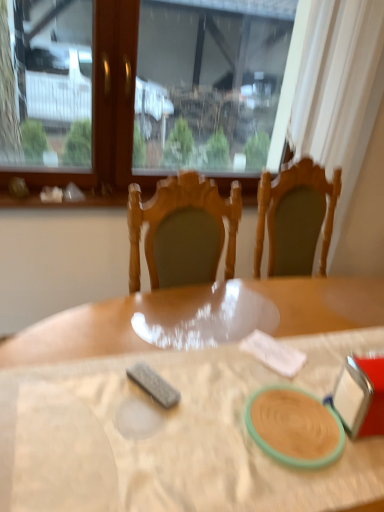
Question: Can you confirm if matte green plate at center is thinner than transparent glass window at upper center?

Choices:
 (A) yes
 (B) no

Answer: (B)

Question: Is matte green plate at center smaller than transparent glass window at upper center?

Choices:
 (A) yes
 (B) no

Answer: (A)

Question: Is matte green plate at center facing away from transparent glass window at upper center?

Choices:
 (A) no
 (B) yes

Answer: (A)

Question: From the image's perspective, is matte green plate at center below transparent glass window at upper center?

Choices:
 (A) no
 (B) yes

Answer: (B)

Question: From a real-world perspective, is matte green plate at center located higher than transparent glass window at upper center?

Choices:
 (A) yes
 (B) no

Answer: (B)

Question: From the image's perspective, is matte green plate at center located above or below transparent glass window at upper center?

Choices:
 (A) above
 (B) below

Answer: (B)

Question: Would you say matte green plate at center is inside or outside transparent glass window at upper center?

Choices:
 (A) outside
 (B) inside

Answer: (A)

Question: Considering the positions of matte green plate at center and transparent glass window at upper center in the image, is matte green plate at center wider or thinner than transparent glass window at upper center?

Choices:
 (A) thin
 (B) wide

Answer: (B)

Question: In the image, is matte green plate at center on the left side or the right side of transparent glass window at upper center?

Choices:
 (A) right
 (B) left

Answer: (A)

Question: Relative to matte green plate at center, is transparent glass window at upper center in front or behind?

Choices:
 (A) behind
 (B) front

Answer: (A)

Question: Do you think transparent glass window at upper center is within matte green plate at center, or outside of it?

Choices:
 (A) inside
 (B) outside

Answer: (B)

Question: Based on their sizes in the image, would you say transparent glass window at upper center is bigger or smaller than matte green plate at center?

Choices:
 (A) big
 (B) small

Answer: (A)

Question: From a real-world perspective, is transparent glass window at upper center above or below matte green plate at center?

Choices:
 (A) below
 (B) above

Answer: (B)

Question: From a real-world perspective, relative to transparent glass window at upper center, is wooden table at center vertically above or below?

Choices:
 (A) above
 (B) below

Answer: (B)

Question: Is wooden table at center bigger or smaller than transparent glass window at upper center?

Choices:
 (A) small
 (B) big

Answer: (B)